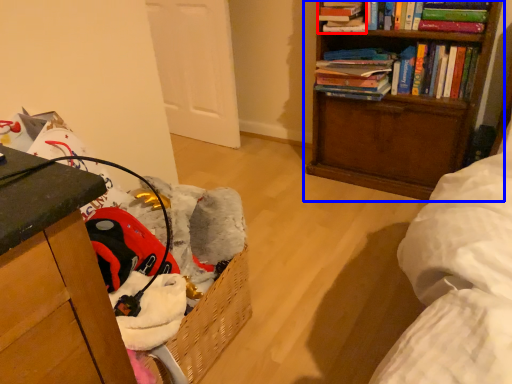
Question: Which point is further to the camera, book (highlighted by a red box) or bookcase (highlighted by a blue box)?

Choices:
 (A) book
 (B) bookcase

Answer: (A)